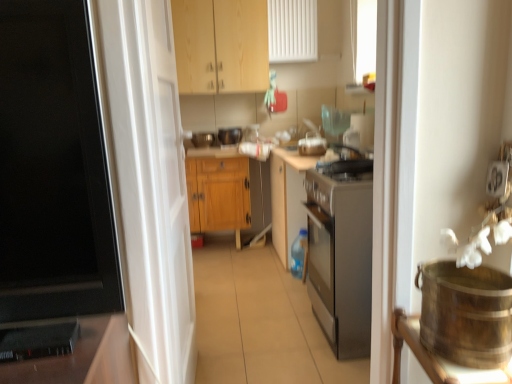
Question: Should I look upward or downward to see wooden cabinet at upper center, arranged as the first cabinetry when viewed from the top?

Choices:
 (A) down
 (B) up

Answer: (B)

Question: Is black plastic speaker at lower left at the right side of wooden cabinet at center, which is the second cabinetry in top-to-bottom order?

Choices:
 (A) yes
 (B) no

Answer: (B)

Question: From a real-world perspective, is black plastic speaker at lower left over wooden cabinet at center, acting as the 1th cabinetry starting from the bottom?

Choices:
 (A) yes
 (B) no

Answer: (A)

Question: Is black plastic speaker at lower left turned away from wooden cabinet at center, acting as the 1th cabinetry starting from the bottom?

Choices:
 (A) yes
 (B) no

Answer: (B)

Question: From the image's perspective, does black plastic speaker at lower left appear lower than wooden cabinet at center, which is the second cabinetry in top-to-bottom order?

Choices:
 (A) no
 (B) yes

Answer: (B)

Question: Is black plastic speaker at lower left completely or partially outside of wooden cabinet at center, acting as the 1th cabinetry starting from the bottom?

Choices:
 (A) no
 (B) yes

Answer: (B)

Question: Is black plastic speaker at lower left smaller than wooden cabinet at center, which is the second cabinetry in top-to-bottom order?

Choices:
 (A) yes
 (B) no

Answer: (A)

Question: Is black plastic speaker at lower left closer to camera compared to wooden cabinet at upper center, acting as the 2th cabinetry starting from the bottom?

Choices:
 (A) no
 (B) yes

Answer: (B)

Question: From a real-world perspective, does black plastic speaker at lower left stand above wooden cabinet at upper center, acting as the 2th cabinetry starting from the bottom?

Choices:
 (A) no
 (B) yes

Answer: (A)

Question: From the image's perspective, is black plastic speaker at lower left below wooden cabinet at upper center, acting as the 2th cabinetry starting from the bottom?

Choices:
 (A) yes
 (B) no

Answer: (A)

Question: Is black plastic speaker at lower left with wooden cabinet at upper center, acting as the 2th cabinetry starting from the bottom?

Choices:
 (A) no
 (B) yes

Answer: (A)

Question: Does black plastic speaker at lower left have a larger size compared to wooden cabinet at upper center, arranged as the first cabinetry when viewed from the top?

Choices:
 (A) no
 (B) yes

Answer: (A)

Question: From a real-world perspective, is black plastic speaker at lower left under wooden cabinet at upper center, acting as the 2th cabinetry starting from the bottom?

Choices:
 (A) yes
 (B) no

Answer: (A)

Question: Is wooden cabinet at center, which is the second cabinetry in top-to-bottom order, smaller than wooden cabinet at upper center, acting as the 2th cabinetry starting from the bottom?

Choices:
 (A) no
 (B) yes

Answer: (B)